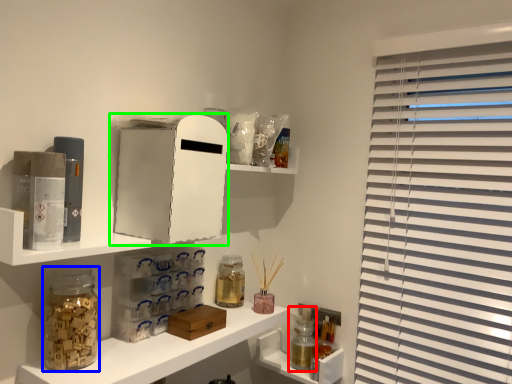
Question: Considering the real-world distances, which object is closest to bottle (highlighted by a red box)? glass jar (highlighted by a blue box) or medicine cabinet (highlighted by a green box).

Choices:
 (A) glass jar
 (B) medicine cabinet

Answer: (B)